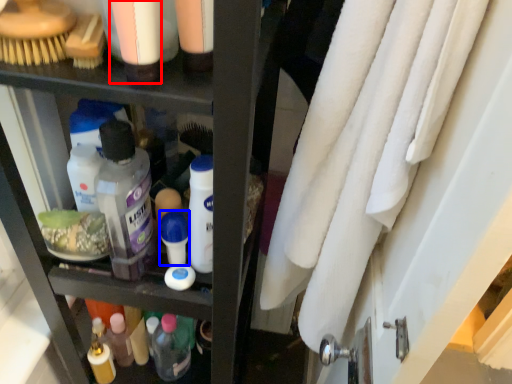
Question: Which object is closer to the camera taking this photo, toiletry (highlighted by a red box) or toiletry (highlighted by a blue box)?

Choices:
 (A) toiletry
 (B) toiletry

Answer: (A)